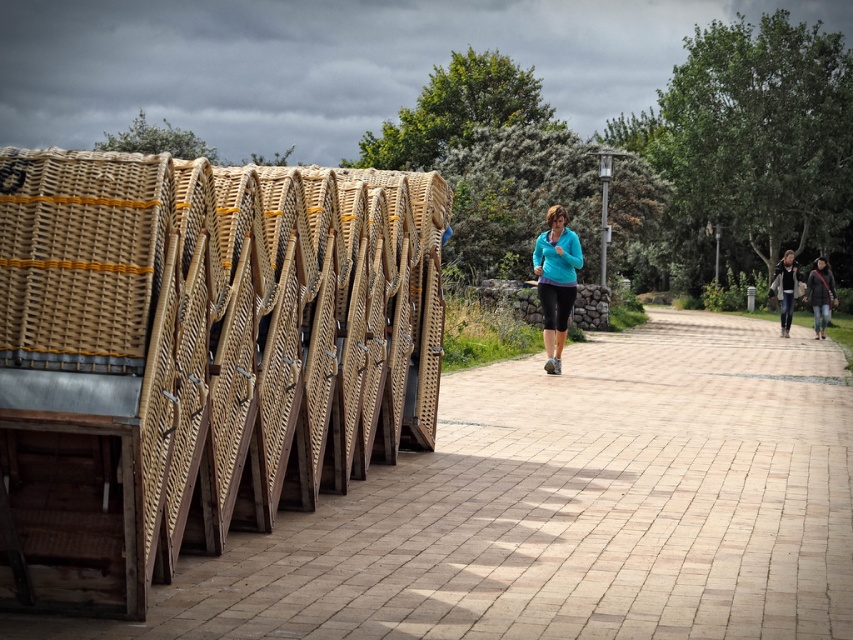
Question: Is teal fleece jacket at center to the left of dark gray knit sweater at center right from the viewer's perspective?

Choices:
 (A) yes
 (B) no

Answer: (A)

Question: Estimate the real-world distances between objects in this image. Which object is farther from the smooth brick pavement at center?

Choices:
 (A) dark gray knit sweater at center right
 (B) woven wood chairs at left
 (C) teal fleece jacket at center

Answer: (A)

Question: Does smooth brick pavement at center appear under dark gray textured jacket at right?

Choices:
 (A) yes
 (B) no

Answer: (A)

Question: Is dark gray knit sweater at center right above dark gray textured jacket at right?

Choices:
 (A) no
 (B) yes

Answer: (A)

Question: Which object is positioned farthest from the teal fleece jacket at center?

Choices:
 (A) dark gray textured jacket at right
 (B) woven wood chairs at left

Answer: (A)

Question: Which is nearer to the woven wood chairs at left?

Choices:
 (A) dark gray textured jacket at right
 (B) dark gray knit sweater at center right
 (C) teal fleece jacket at center
 (D) smooth brick pavement at center

Answer: (D)